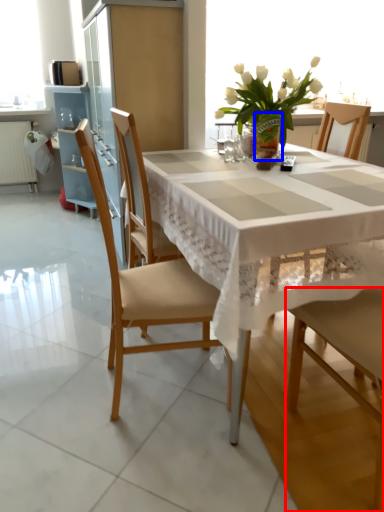
Question: Which object is closer to the camera taking this photo, chair (highlighted by a red box) or vase (highlighted by a blue box)?

Choices:
 (A) chair
 (B) vase

Answer: (A)